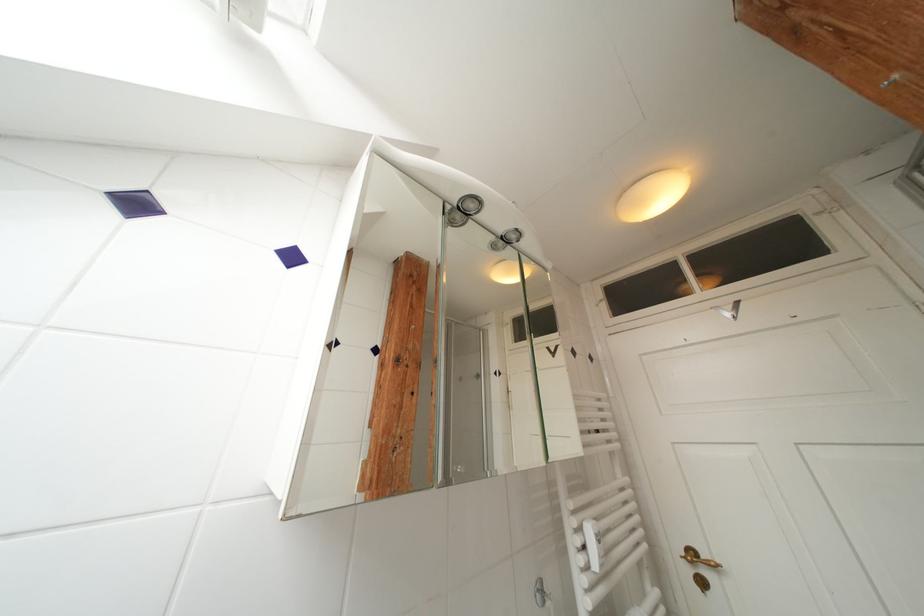
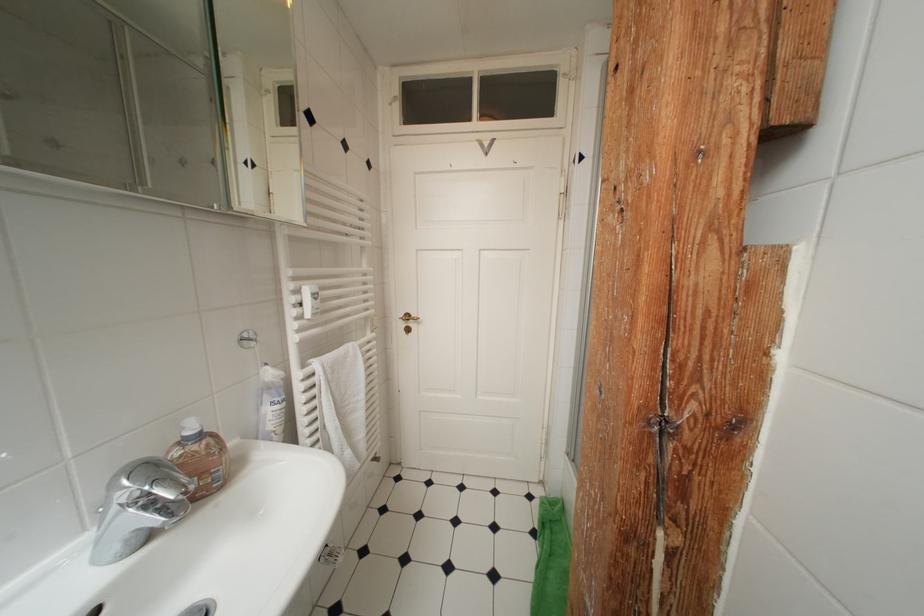
Locate, in the second image, the point that corresponds to (x=586, y=533) in the first image.

(304, 294)